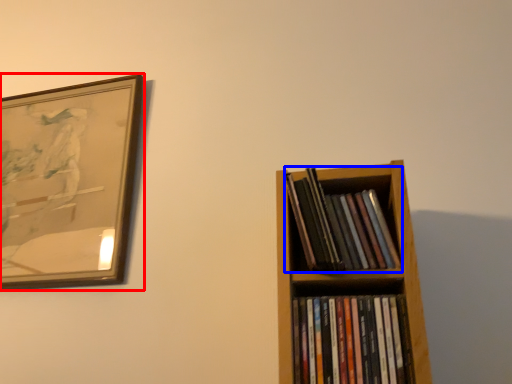
Question: Which of the following is the closest to the observer, picture frame (highlighted by a red box) or book (highlighted by a blue box)?

Choices:
 (A) picture frame
 (B) book

Answer: (B)